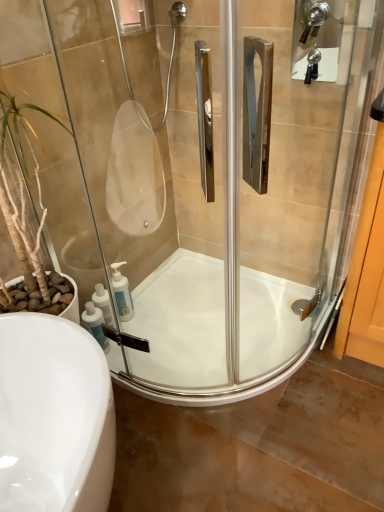
Question: Considering the relative positions of white plastic soap dispenser at lower left, which is the 1th soap dispenser in front-to-back order, and transparent glass shower door at center in the image provided, is white plastic soap dispenser at lower left, which is the 1th soap dispenser in front-to-back order, to the right of transparent glass shower door at center from the viewer's perspective?

Choices:
 (A) yes
 (B) no

Answer: (B)

Question: From the image's perspective, is white plastic soap dispenser at lower left, which is the second soap dispenser in back-to-front order, located above transparent glass shower door at center?

Choices:
 (A) yes
 (B) no

Answer: (B)

Question: Is white plastic soap dispenser at lower left, which is the 1th soap dispenser in front-to-back order, looking in the opposite direction of transparent glass shower door at center?

Choices:
 (A) yes
 (B) no

Answer: (A)

Question: Can you confirm if white plastic soap dispenser at lower left, which is the 1th soap dispenser in front-to-back order, is positioned to the left of transparent glass shower door at center?

Choices:
 (A) yes
 (B) no

Answer: (A)

Question: From a real-world perspective, is white plastic soap dispenser at lower left, which is the second soap dispenser in back-to-front order, over transparent glass shower door at center?

Choices:
 (A) yes
 (B) no

Answer: (B)

Question: Is white plastic soap dispenser at lower left, which is the second soap dispenser in back-to-front order, smaller than transparent glass shower door at center?

Choices:
 (A) no
 (B) yes

Answer: (B)

Question: Could white plastic soap dispenser at lower left, the first soap dispenser from the back, be considered to be inside transparent glass shower door at center?

Choices:
 (A) yes
 (B) no

Answer: (B)

Question: Is transparent glass shower door at center shorter than white plastic soap dispenser at lower left, the first soap dispenser from the back?

Choices:
 (A) no
 (B) yes

Answer: (A)

Question: From the image's perspective, is transparent glass shower door at center beneath white plastic soap dispenser at lower left, acting as the second soap dispenser starting from the front?

Choices:
 (A) no
 (B) yes

Answer: (A)

Question: Is transparent glass shower door at center positioned with its back to white plastic soap dispenser at lower left, the first soap dispenser from the back?

Choices:
 (A) no
 (B) yes

Answer: (B)

Question: Is transparent glass shower door at center positioned far away from white plastic soap dispenser at lower left, the first soap dispenser from the back?

Choices:
 (A) no
 (B) yes

Answer: (A)

Question: From a real-world perspective, is transparent glass shower door at center under white plastic soap dispenser at lower left, the first soap dispenser from the back?

Choices:
 (A) no
 (B) yes

Answer: (A)

Question: Considering the relative sizes of white plastic soap dispenser at lower left, which is the 1th soap dispenser in front-to-back order, and white glossy bath at center in the image provided, is white plastic soap dispenser at lower left, which is the 1th soap dispenser in front-to-back order, taller than white glossy bath at center?

Choices:
 (A) no
 (B) yes

Answer: (B)